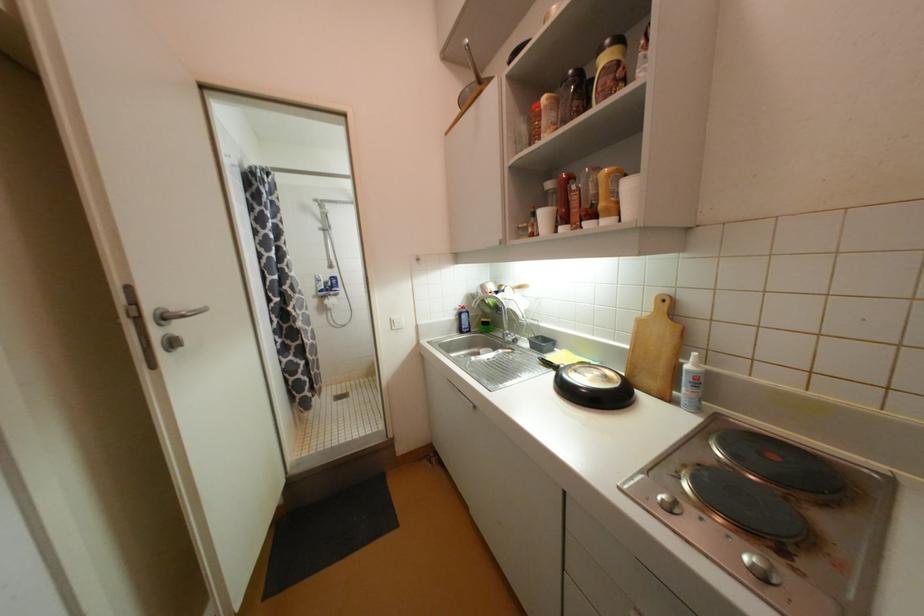
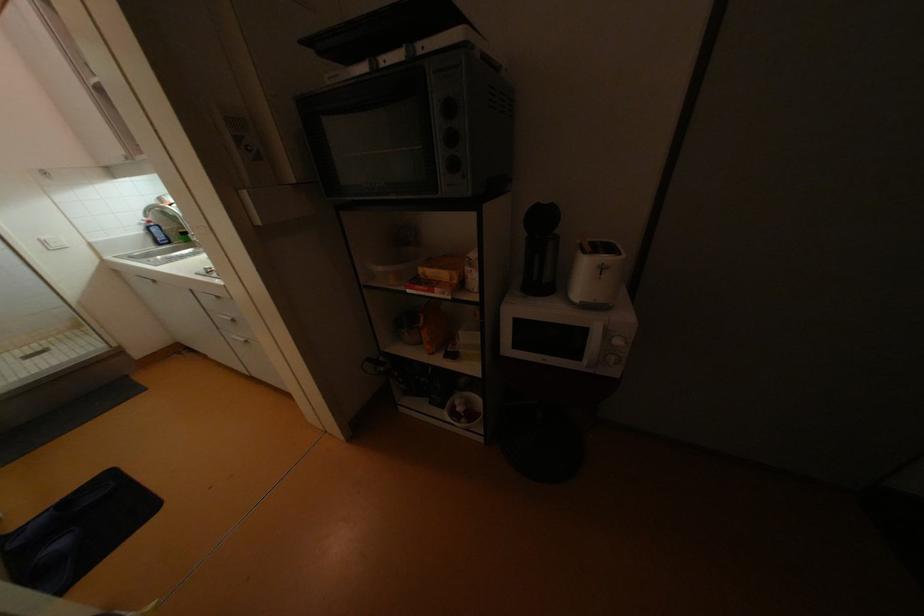
In the second image, find the point that corresponds to point 468,317 in the first image.

(160, 231)